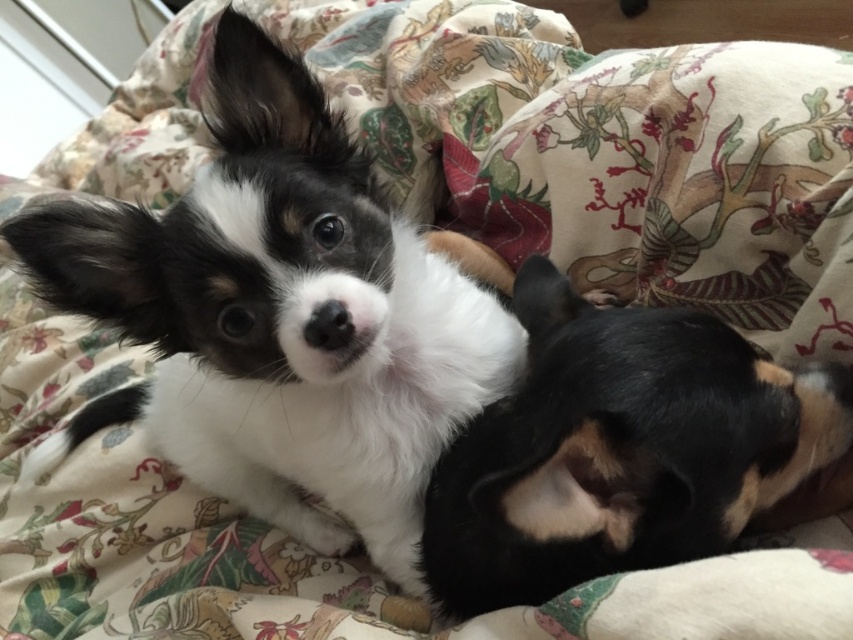
You are looking at the bed with the floral blanket. There is a black and white fur at upper left and a black soft fur dog at lower right. Which dog is positioned more to the left side of the bed?

The black and white fur at upper left is positioned more to the left side of the bed.

You are a dog trainer assessing the space between the black and white fur at upper left and the black soft fur dog at lower right. If the minimum required distance for two dogs to rest comfortably without touching each other is 8 inches, is the current distance sufficient?

The black and white fur at upper left and the black soft fur dog at lower right are 7.94 inches apart from each other. Since the required distance is 8 inches, the current spacing is insufficient for them to rest comfortably without touching.